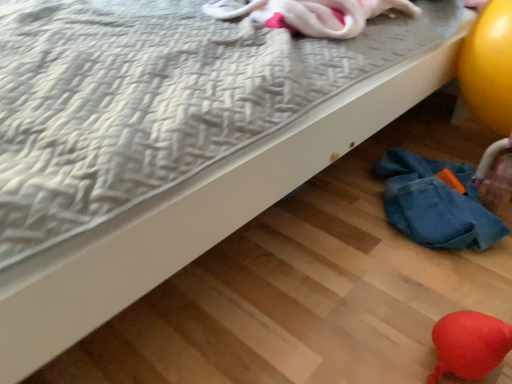
Locate an element on the screen. This screenshot has height=384, width=512. vacant space situated on the left part of rubberized red balloon at lower right is located at coordinates (342, 349).